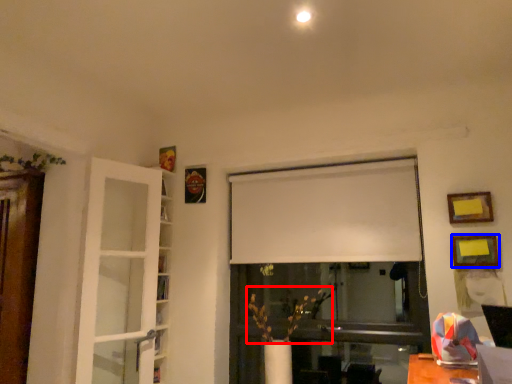
Question: Which of the following is the closest to the observer, plant (highlighted by a red box) or picture frame (highlighted by a blue box)?

Choices:
 (A) plant
 (B) picture frame

Answer: (B)